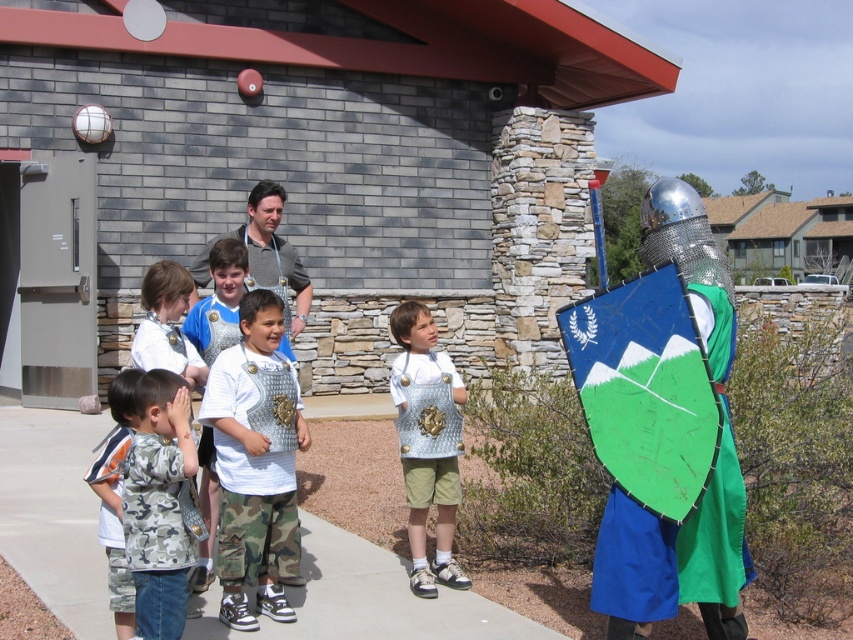
Question: Can you confirm if camo fabric shirt at left is wider than metallic silver armor at center?

Choices:
 (A) yes
 (B) no

Answer: (B)

Question: Is shiny metallic helmet at right bigger than metallic armor at center?

Choices:
 (A) no
 (B) yes

Answer: (B)

Question: Is shiny metallic helmet at right thinner than metallic armor at center?

Choices:
 (A) no
 (B) yes

Answer: (A)

Question: Which is farther from the metallic armor at center?

Choices:
 (A) metallic silver armor at center
 (B) shiny metallic helmet at right
 (C) camo fabric shirt at left

Answer: (B)

Question: Among these objects, which one is nearest to the camera?

Choices:
 (A) shiny metallic helmet at right
 (B) camo fabric shirt at left
 (C) metallic armor at center

Answer: (A)

Question: Which object is farther from the camera taking this photo?

Choices:
 (A) metallic armor at center
 (B) shiny metallic helmet at right

Answer: (A)